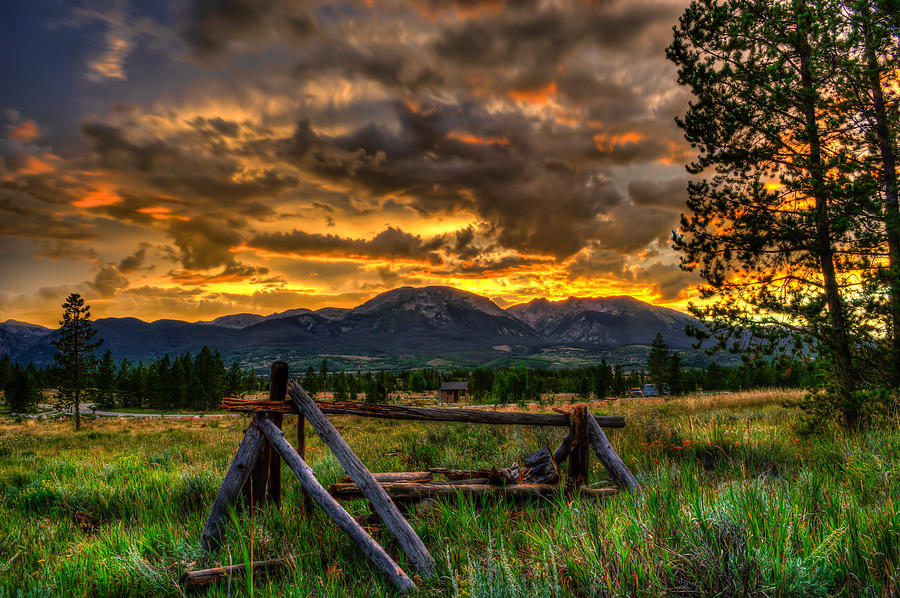
Image resolution: width=900 pixels, height=598 pixels. In order to click on door in this screenshot , I will do `click(454, 398)`.